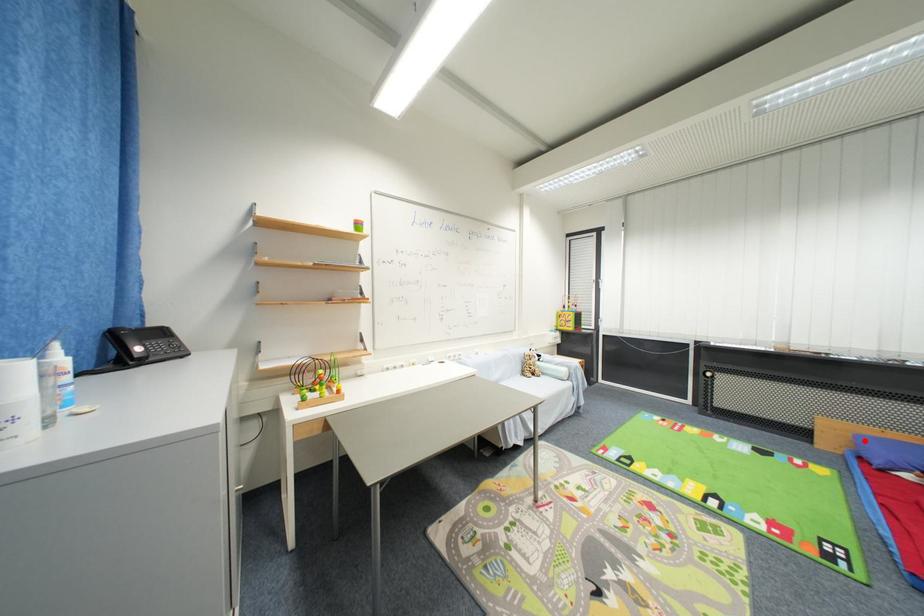
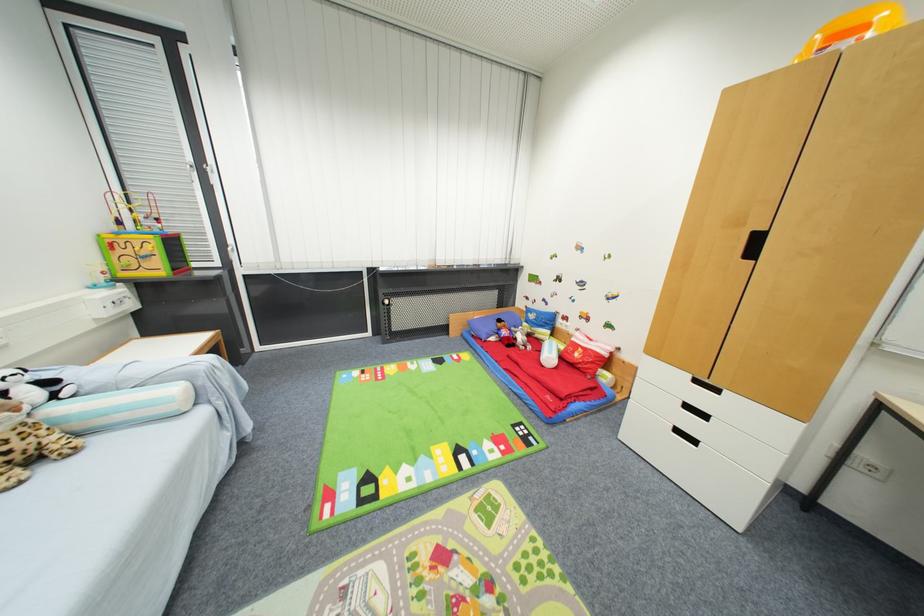
Question: I am providing you with two images of the same scene from different viewpoints. In image1, a red point is highlighted. Considering the same 3D point in image2, which of the following is correct?

Choices:
 (A) It is closer
 (B) It is farther

Answer: (B)